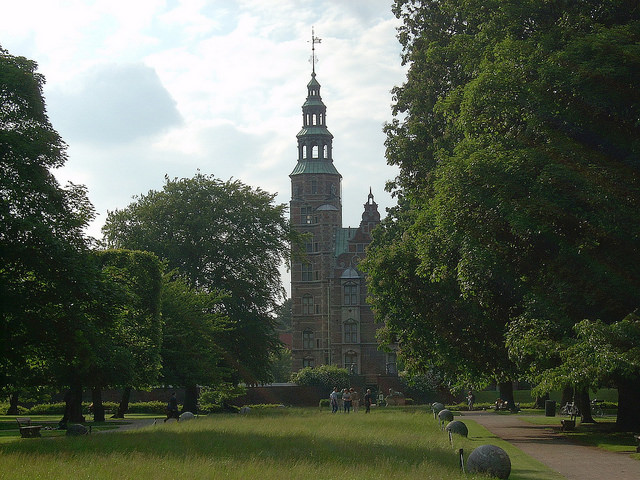
The image size is (640, 480). What are the coordinates of `wall` in the screenshot? It's located at (269, 388), (147, 393).